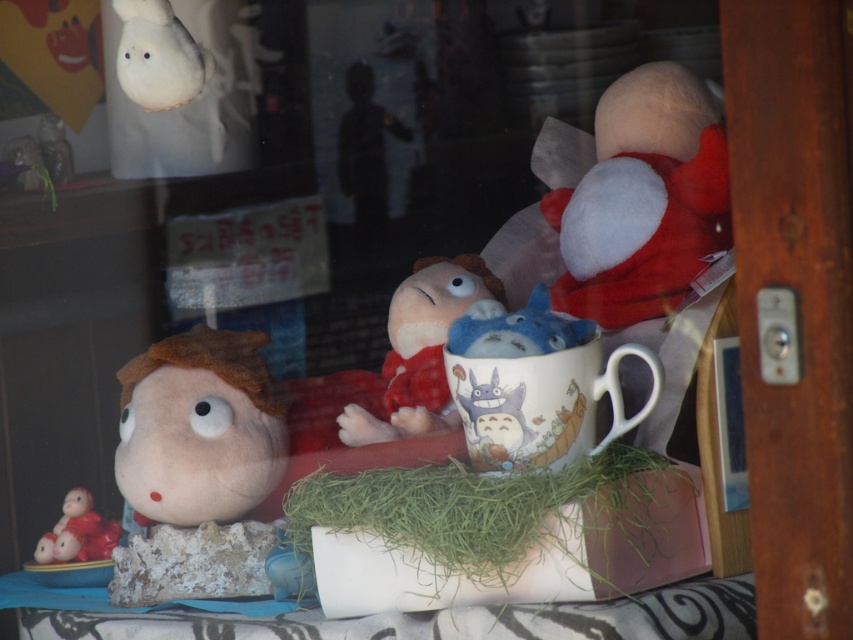
Is green grassy hay at center closer to camera compared to white plush toy at upper right?

Yes, green grassy hay at center is closer to the viewer.

Does green grassy hay at center have a lesser width compared to white plush toy at upper right?

No, green grassy hay at center is not thinner than white plush toy at upper right.

This screenshot has height=640, width=853. What do you see at coordinates (496, 532) in the screenshot?
I see `green grassy hay at center` at bounding box center [496, 532].

At what (x,y) coordinates should I click in order to perform the action: click on green grassy hay at center. Please return your answer as a coordinate pair (x, y). Looking at the image, I should click on (496, 532).

Based on the photo, between white plush toy at upper right and matte red figurine at lower left, which one is positioned higher?

Positioned higher is white plush toy at upper right.

Is point (556, 204) more distant than point (59, 522)?

That is True.

Identify the location of white plush toy at upper right. This screenshot has width=853, height=640. (643, 198).

Between white plush toy at upper right and fuzzy beige doll at left, which one has more height?

white plush toy at upper right is taller.

Can you confirm if white plush toy at upper right is positioned to the left of fuzzy beige doll at left?

No, white plush toy at upper right is not to the left of fuzzy beige doll at left.

Between point (558, 196) and point (160, 497), which one is positioned behind?

Point (558, 196)

Identify the location of white plush toy at upper right. (643, 198).